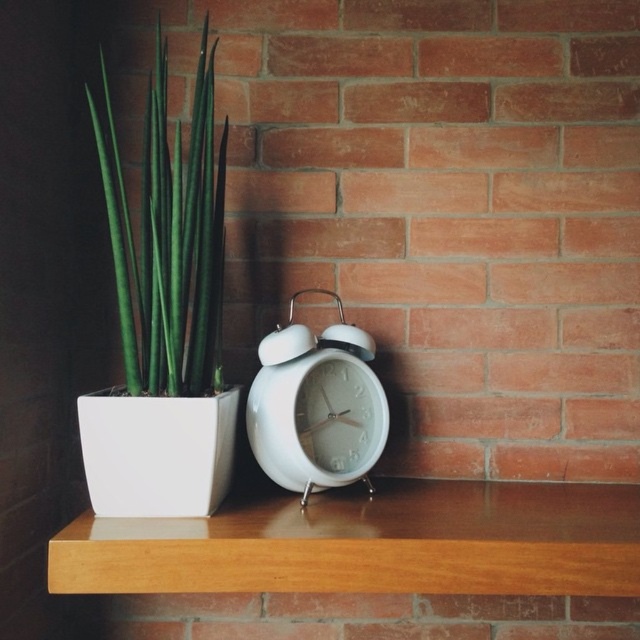
Is wooden shelf at center smaller than white glossy alarm clock at center?

Incorrect, wooden shelf at center is not smaller in size than white glossy alarm clock at center.

Does wooden shelf at center lie in front of white glossy alarm clock at center?

Yes, it is in front of white glossy alarm clock at center.

Measure the distance between point (452, 554) and camera.

34.88 inches

The image size is (640, 640). In order to click on wooden shelf at center in this screenshot , I will do `click(369, 541)`.

Is wooden shelf at center wider than green glossy plant at left?

Yes, wooden shelf at center is wider than green glossy plant at left.

Is wooden shelf at center taller than green glossy plant at left?

Incorrect, wooden shelf at center's height is not larger of green glossy plant at left's.

The height and width of the screenshot is (640, 640). What do you see at coordinates (369, 541) in the screenshot?
I see `wooden shelf at center` at bounding box center [369, 541].

I want to click on wooden shelf at center, so [369, 541].

Does green glossy plant at left have a lesser width compared to white glossy alarm clock at center?

No.

Does point (189, 259) come closer to viewer compared to point (280, 470)?

That is True.

You are a GUI agent. You are given a task and a screenshot of the screen. Output one action in this format:
    pyautogui.click(x=<x>, y=<y>)
    Task: Click on the green glossy plant at left
    
    Given the screenshot: What is the action you would take?
    pyautogui.click(x=170, y=237)